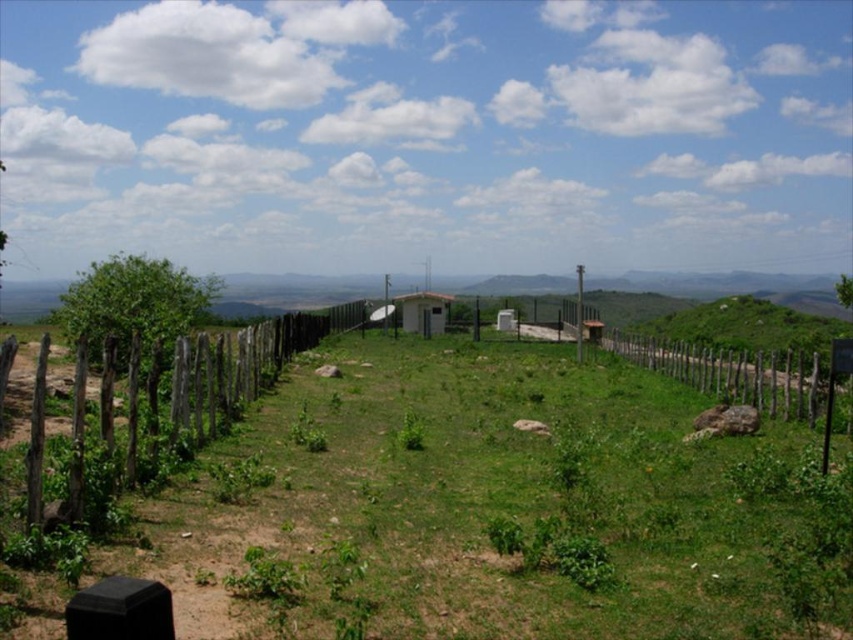
Question: Is green grassy field at center above white matte hut at center?

Choices:
 (A) yes
 (B) no

Answer: (B)

Question: Is brown wooden fence at left bigger than wooden fence at center?

Choices:
 (A) no
 (B) yes

Answer: (A)

Question: Which object appears closest to the camera in this image?

Choices:
 (A) green grassy field at center
 (B) white matte hut at center
 (C) wooden fence at center
 (D) brown wooden fence at left

Answer: (A)

Question: In this image, where is wooden fence at center located relative to white matte hut at center?

Choices:
 (A) below
 (B) above

Answer: (A)

Question: Which object appears farthest from the camera in this image?

Choices:
 (A) white matte hut at center
 (B) brown wooden fence at left

Answer: (A)

Question: Estimate the real-world distances between objects in this image. Which object is farther from the white matte hut at center?

Choices:
 (A) wooden fence at center
 (B) green grassy field at center

Answer: (B)